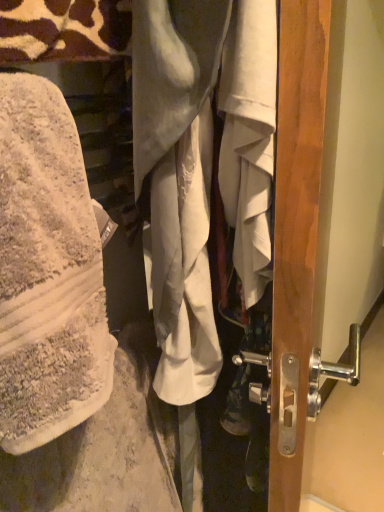
Question: Is the depth of white cotton wrap at left, which is the 2th wrap from right to left, less than that of white cotton shirt at center, the first wrap positioned from the right?

Choices:
 (A) yes
 (B) no

Answer: (A)

Question: Can you confirm if white cotton wrap at left, which appears as the first wrap when viewed from the left, is wider than white cotton shirt at center, the first wrap positioned from the right?

Choices:
 (A) no
 (B) yes

Answer: (B)

Question: Can you confirm if white cotton wrap at left, which is the 2th wrap from right to left, is bigger than white cotton shirt at center, the first wrap positioned from the right?

Choices:
 (A) no
 (B) yes

Answer: (A)

Question: Considering the relative sizes of white cotton wrap at left, which is the 2th wrap from right to left, and white cotton shirt at center, placed as the second wrap when sorted from left to right, in the image provided, is white cotton wrap at left, which is the 2th wrap from right to left, thinner than white cotton shirt at center, placed as the second wrap when sorted from left to right,?

Choices:
 (A) no
 (B) yes

Answer: (A)

Question: Can you confirm if white cotton wrap at left, which appears as the first wrap when viewed from the left, is taller than white cotton shirt at center, the first wrap positioned from the right?

Choices:
 (A) yes
 (B) no

Answer: (B)

Question: Can you see white cotton wrap at left, which is the 2th wrap from right to left, touching white cotton shirt at center, the first wrap positioned from the right?

Choices:
 (A) no
 (B) yes

Answer: (B)

Question: Is white cotton shirt at center, placed as the second wrap when sorted from left to right, far away from white cotton wrap at left, which appears as the first wrap when viewed from the left?

Choices:
 (A) no
 (B) yes

Answer: (A)

Question: Does white cotton shirt at center, placed as the second wrap when sorted from left to right, turn towards white cotton wrap at left, which is the 2th wrap from right to left?

Choices:
 (A) yes
 (B) no

Answer: (B)

Question: Can you confirm if white cotton shirt at center, the first wrap positioned from the right, is smaller than white cotton wrap at left, which is the 2th wrap from right to left?

Choices:
 (A) yes
 (B) no

Answer: (B)

Question: From the image's perspective, is white cotton shirt at center, placed as the second wrap when sorted from left to right, beneath white cotton wrap at left, which is the 2th wrap from right to left?

Choices:
 (A) yes
 (B) no

Answer: (B)

Question: Is white cotton shirt at center, the first wrap positioned from the right, to the right of white cotton wrap at left, which is the 2th wrap from right to left, from the viewer's perspective?

Choices:
 (A) yes
 (B) no

Answer: (A)

Question: Is white cotton shirt at center, placed as the second wrap when sorted from left to right, located outside white cotton wrap at left, which appears as the first wrap when viewed from the left?

Choices:
 (A) no
 (B) yes

Answer: (B)

Question: In terms of width, does white cotton wrap at left, which is the 2th wrap from right to left, look wider or thinner when compared to white cotton shirt at center, the first wrap positioned from the right?

Choices:
 (A) thin
 (B) wide

Answer: (B)